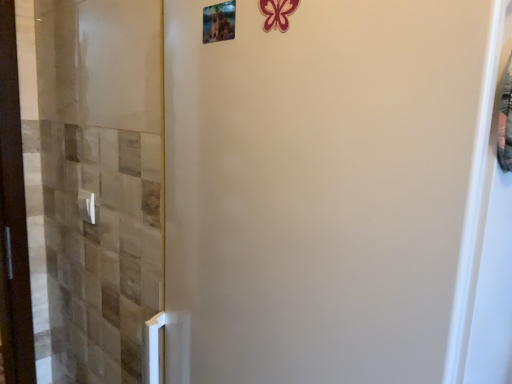
Question: From a real-world perspective, is metallic photo frame at upper center physically located above or below white plastic door handle at lower left?

Choices:
 (A) below
 (B) above

Answer: (B)

Question: Is metallic photo frame at upper center inside the boundaries of white plastic door handle at lower left, or outside?

Choices:
 (A) inside
 (B) outside

Answer: (B)

Question: In terms of size, does metallic photo frame at upper center appear bigger or smaller than white plastic door handle at lower left?

Choices:
 (A) small
 (B) big

Answer: (A)

Question: Do you think white plastic door handle at lower left is within metallic photo frame at upper center, or outside of it?

Choices:
 (A) inside
 (B) outside

Answer: (B)

Question: Considering their positions, is white plastic door handle at lower left located in front of or behind metallic photo frame at upper center?

Choices:
 (A) behind
 (B) front

Answer: (A)

Question: Based on their sizes in the image, would you say white plastic door handle at lower left is bigger or smaller than metallic photo frame at upper center?

Choices:
 (A) small
 (B) big

Answer: (B)

Question: Does point (91, 195) appear closer or farther from the camera than point (203, 23)?

Choices:
 (A) closer
 (B) farther

Answer: (B)